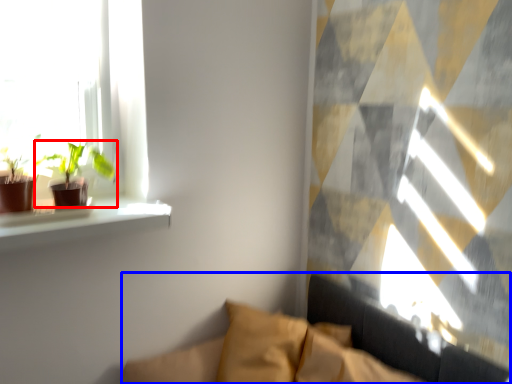
Question: Which of the following is the closest to the observer, houseplant (highlighted by a red box) or couch (highlighted by a blue box)?

Choices:
 (A) houseplant
 (B) couch

Answer: (B)